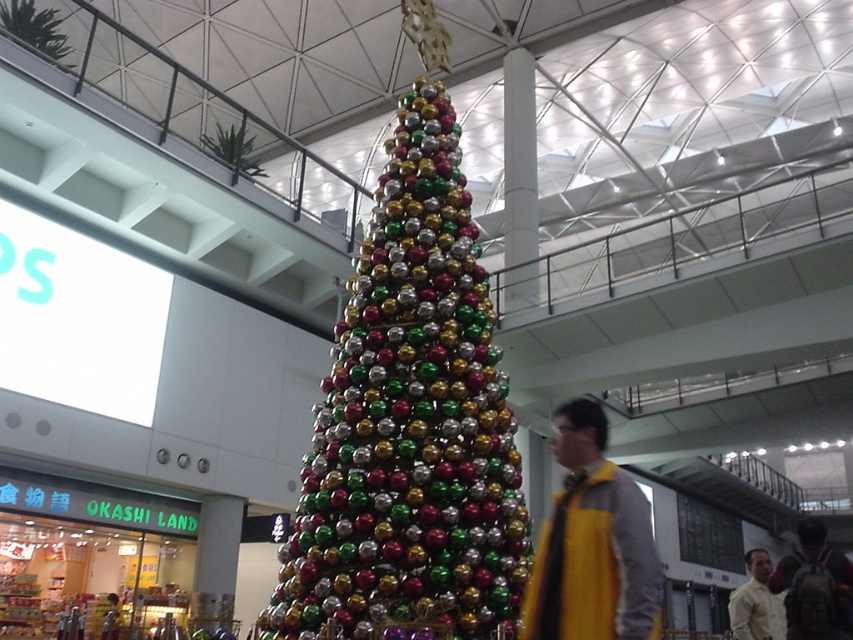
Question: Does shiny metallic ornaments at center appear on the right side of yellow fabric at center?

Choices:
 (A) no
 (B) yes

Answer: (A)

Question: Which object is positioned farthest from the yellow wool sweater at center?

Choices:
 (A) yellow fabric shirt at lower right
 (B) shiny metallic ornaments at center
 (C) yellow fabric at center

Answer: (C)

Question: Which point is closer to the camera?

Choices:
 (A) (738, 625)
 (B) (558, 609)
 (C) (431, 566)

Answer: (B)

Question: Does yellow fabric at center lie behind yellow wool sweater at center?

Choices:
 (A) no
 (B) yes

Answer: (A)

Question: Does yellow fabric at center appear on the right side of yellow wool sweater at center?

Choices:
 (A) no
 (B) yes

Answer: (A)

Question: Which point appears farthest from the camera in this image?

Choices:
 (A) (410, 292)
 (B) (827, 604)
 (C) (732, 593)
 (D) (627, 628)

Answer: (C)